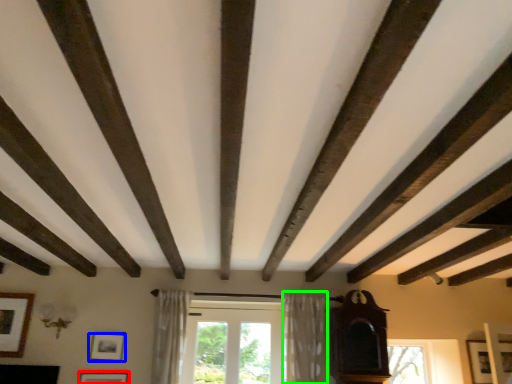
Question: Which object is the closest to the picture frame (highlighted by a red box)? Choose among these: picture frame (highlighted by a blue box) or curtain (highlighted by a green box).

Choices:
 (A) picture frame
 (B) curtain

Answer: (A)